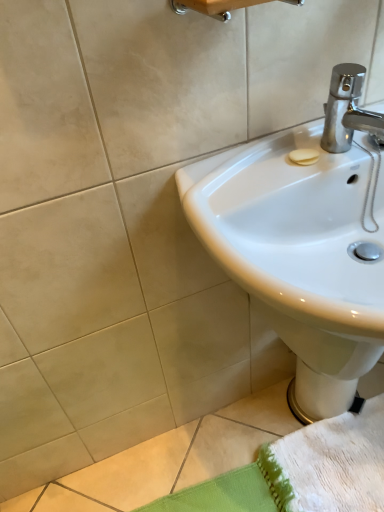
Question: Can you confirm if wooden towel bar at upper center is wider than white glossy sink at upper right?

Choices:
 (A) yes
 (B) no

Answer: (B)

Question: Is wooden towel bar at upper center placed right next to white glossy sink at upper right?

Choices:
 (A) yes
 (B) no

Answer: (B)

Question: Is wooden towel bar at upper center facing towards white glossy sink at upper right?

Choices:
 (A) yes
 (B) no

Answer: (B)

Question: From the image's perspective, would you say wooden towel bar at upper center is shown under white glossy sink at upper right?

Choices:
 (A) no
 (B) yes

Answer: (A)

Question: Can you confirm if wooden towel bar at upper center is thinner than white glossy sink at upper right?

Choices:
 (A) yes
 (B) no

Answer: (A)

Question: Based on their sizes in the image, would you say wooden towel bar at upper center is bigger or smaller than white glossy bidet at lower right?

Choices:
 (A) small
 (B) big

Answer: (A)

Question: From the image's perspective, is wooden towel bar at upper center located above or below white glossy bidet at lower right?

Choices:
 (A) above
 (B) below

Answer: (A)

Question: From a real-world perspective, relative to white glossy bidet at lower right, is wooden towel bar at upper center vertically above or below?

Choices:
 (A) below
 (B) above

Answer: (B)

Question: Considering their positions, is wooden towel bar at upper center located in front of or behind white glossy bidet at lower right?

Choices:
 (A) behind
 (B) front

Answer: (B)

Question: From their relative heights in the image, would you say white glossy bidet at lower right is taller or shorter than wooden towel bar at upper center?

Choices:
 (A) short
 (B) tall

Answer: (B)

Question: Is point (314, 371) positioned closer to the camera than point (249, 4)?

Choices:
 (A) farther
 (B) closer

Answer: (A)

Question: Is white glossy bidet at lower right inside the boundaries of wooden towel bar at upper center, or outside?

Choices:
 (A) outside
 (B) inside

Answer: (A)

Question: In the image, is white glossy bidet at lower right on the left side or the right side of wooden towel bar at upper center?

Choices:
 (A) right
 (B) left

Answer: (A)

Question: Considering the positions of white glossy sink at upper right and wooden towel bar at upper center in the image, is white glossy sink at upper right taller or shorter than wooden towel bar at upper center?

Choices:
 (A) short
 (B) tall

Answer: (B)

Question: Choose the correct answer: Is white glossy sink at upper right inside wooden towel bar at upper center or outside it?

Choices:
 (A) inside
 (B) outside

Answer: (B)